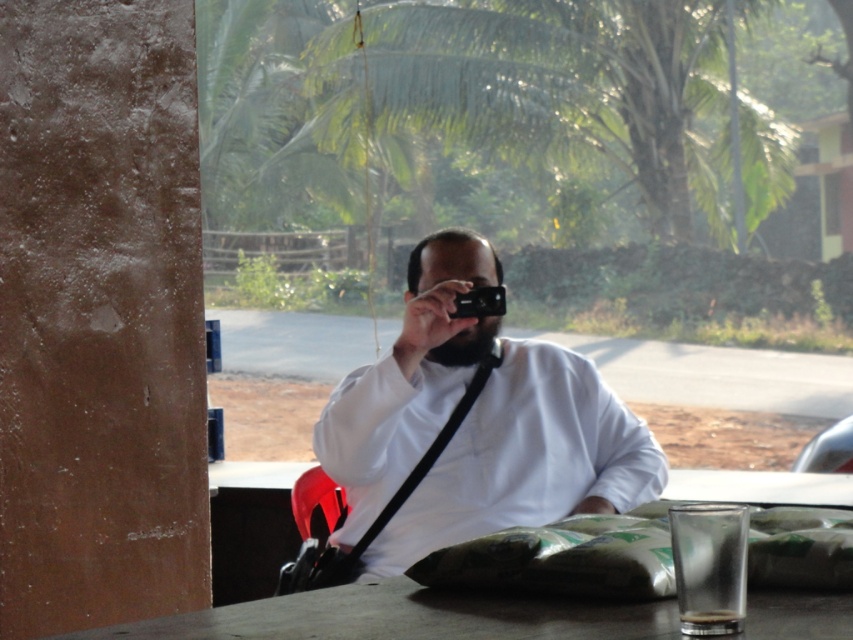
Question: Which point is closer to the camera?

Choices:
 (A) click(x=473, y=296)
 (B) click(x=659, y=458)

Answer: (B)

Question: Is white matte shirt at center to the right of black plastic camera at center from the viewer's perspective?

Choices:
 (A) no
 (B) yes

Answer: (B)

Question: Which point is closer to the camera?

Choices:
 (A) white matte shirt at center
 (B) black plastic camera at center

Answer: (A)

Question: Does white matte shirt at center appear on the right side of black plastic camera at center?

Choices:
 (A) no
 (B) yes

Answer: (B)

Question: Where is white matte shirt at center located in relation to black plastic camera at center in the image?

Choices:
 (A) above
 (B) below

Answer: (B)